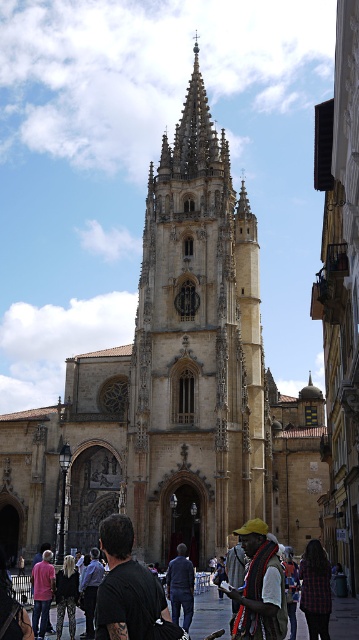
Question: Which point is farther from the camera taking this photo?

Choices:
 (A) (174, 161)
 (B) (320, 554)
 (C) (295, 592)

Answer: (A)

Question: Among these points, which one is nearest to the camera?

Choices:
 (A) (92, 573)
 (B) (286, 554)

Answer: (A)

Question: Can you confirm if camouflage pants at lower center is positioned below dark blue shirt at center?

Choices:
 (A) yes
 (B) no

Answer: (A)

Question: Can you confirm if dark blue shirt at center is wider than denim jacket at lower center?

Choices:
 (A) no
 (B) yes

Answer: (A)

Question: Which point is farther to the camera?

Choices:
 (A) (156, 209)
 (B) (72, 604)
 (C) (236, 612)

Answer: (A)

Question: Does plaid shirt at center have a smaller size compared to camouflage pants at lower center?

Choices:
 (A) no
 (B) yes

Answer: (A)